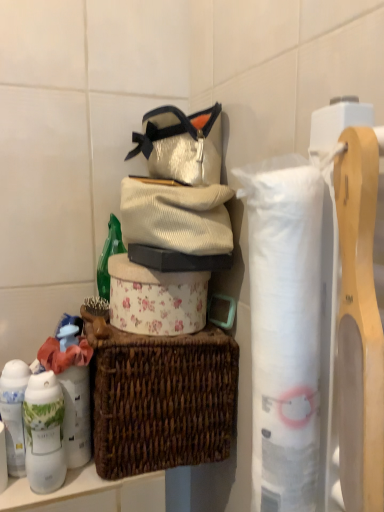
Question: Does white paper towel at right, acting as the second toilet paper starting from the left, have a greater width compared to corduroy sweater at center?

Choices:
 (A) no
 (B) yes

Answer: (A)

Question: Is white paper towel at right, which is the 2th toilet paper from back to front, bigger than corduroy sweater at center?

Choices:
 (A) yes
 (B) no

Answer: (B)

Question: Would you say corduroy sweater at center is part of white paper towel at right, acting as the second toilet paper starting from the left,'s contents?

Choices:
 (A) yes
 (B) no

Answer: (B)

Question: Is the depth of white paper towel at right, which is the 2th toilet paper from back to front, less than that of corduroy sweater at center?

Choices:
 (A) yes
 (B) no

Answer: (A)

Question: Considering the relative sizes of white paper towel at right, acting as the second toilet paper starting from the left, and corduroy sweater at center in the image provided, is white paper towel at right, acting as the second toilet paper starting from the left, smaller than corduroy sweater at center?

Choices:
 (A) no
 (B) yes

Answer: (B)

Question: Considering the positions of white matte toilet paper at center, which is counted as the 2th toilet paper, starting from the front, and white glossy lotion at lower left, the 2th toiletry viewed from the right, in the image, is white matte toilet paper at center, which is counted as the 2th toilet paper, starting from the front, taller or shorter than white glossy lotion at lower left, the 2th toiletry viewed from the right,?

Choices:
 (A) tall
 (B) short

Answer: (B)

Question: Looking at the image, does white matte toilet paper at center, arranged as the 1th toilet paper when viewed from the left, seem bigger or smaller compared to white glossy lotion at lower left, the 2th toiletry viewed from the right?

Choices:
 (A) small
 (B) big

Answer: (B)

Question: From the image's perspective, is white matte toilet paper at center, which is counted as the 2th toilet paper, starting from the front, positioned above or below white glossy lotion at lower left, the 2th toiletry viewed from the right?

Choices:
 (A) below
 (B) above

Answer: (B)

Question: Considering their positions, is white matte toilet paper at center, which ranks as the 2th toilet paper in right-to-left order, located in front of or behind white glossy lotion at lower left, the 2th toiletry viewed from the right?

Choices:
 (A) front
 (B) behind

Answer: (B)

Question: Based on their sizes in the image, would you say corduroy sweater at center is bigger or smaller than brown woven picnic basket at center?

Choices:
 (A) big
 (B) small

Answer: (B)

Question: From a real-world perspective, is corduroy sweater at center physically located above or below brown woven picnic basket at center?

Choices:
 (A) below
 (B) above

Answer: (B)

Question: Is corduroy sweater at center taller or shorter than brown woven picnic basket at center?

Choices:
 (A) short
 (B) tall

Answer: (A)

Question: Do you think corduroy sweater at center is within brown woven picnic basket at center, or outside of it?

Choices:
 (A) outside
 (B) inside

Answer: (A)

Question: Visually, is white glossy lotion at lower left, the 2th toiletry viewed from the right, positioned to the left or to the right of white matte toilet paper at center, arranged as the 1th toilet paper when viewed from the left?

Choices:
 (A) left
 (B) right

Answer: (A)

Question: Is white glossy lotion at lower left, which is counted as the 1th toiletry, starting from the left, bigger or smaller than white matte toilet paper at center, arranged as the 1th toilet paper when viewed from the left?

Choices:
 (A) big
 (B) small

Answer: (B)